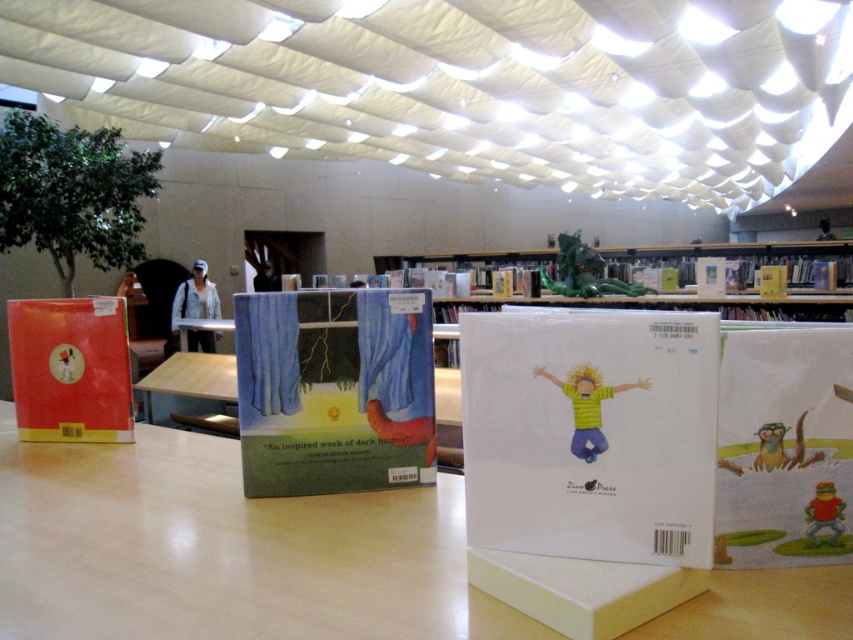
Consider the image. Can you confirm if matte paper book at center is positioned to the left of matte cardboard table at center?

Incorrect, matte paper book at center is not on the left side of matte cardboard table at center.

Does point (822, 340) lie behind point (160, 384)?

No, (822, 340) is closer to viewer.

Between point (720, 477) and point (451, 412), which one is positioned behind?

The point (451, 412) is behind.

You are a GUI agent. You are given a task and a screenshot of the screen. Output one action in this format:
    pyautogui.click(x=<x>, y=<y>)
    Task: Click on the matte paper book at center
    This screenshot has height=640, width=853.
    Given the screenshot: What is the action you would take?
    pyautogui.click(x=782, y=445)

Does matte red book at left have a greater height compared to matte cardboard table at center?

No.

Which is behind, point (67, 435) or point (229, 365)?

Positioned behind is point (229, 365).

Find the location of a particular element. matte red book at left is located at coordinates (70, 369).

You are a GUI agent. You are given a task and a screenshot of the screen. Output one action in this format:
    pyautogui.click(x=<x>, y=<y>)
    Task: Click on the matte red book at left
    The height and width of the screenshot is (640, 853).
    Given the screenshot: What is the action you would take?
    pyautogui.click(x=70, y=369)

What do you see at coordinates (223, 548) in the screenshot? I see `light brown wooden table at center` at bounding box center [223, 548].

Is point (254, 515) behind point (802, 275)?

No, it is in front of (802, 275).

Does point (74, 557) lie in front of point (474, 257)?

Yes, it is in front of point (474, 257).

Locate an element on the screen. This screenshot has height=640, width=853. light brown wooden table at center is located at coordinates (223, 548).